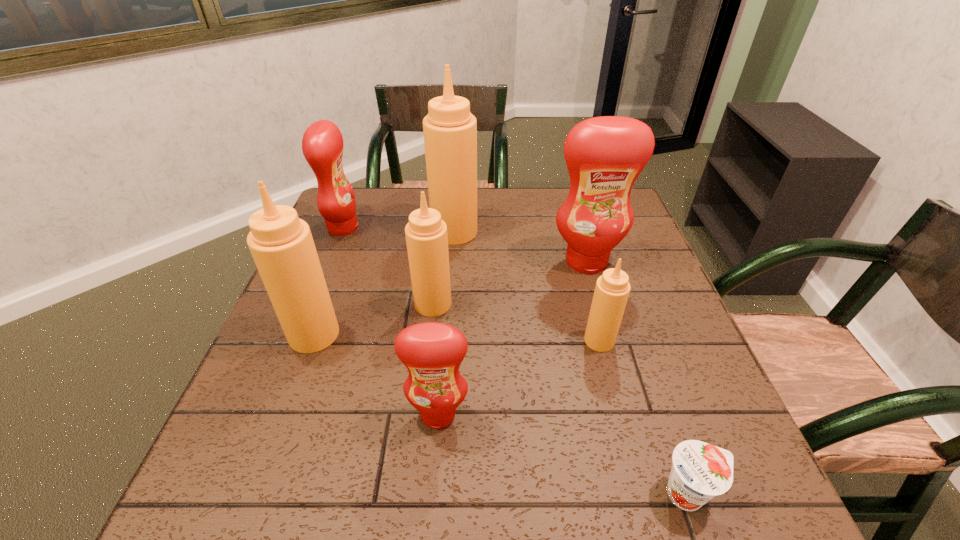
Find the location of a particular element. vacant space located 0.240m on the back of the nearest object is located at coordinates (640, 355).

Find the location of a particular element. object at the near edge is located at coordinates (700, 471).

Where is `condiment located in the right edge section of the desktop`? condiment located in the right edge section of the desktop is located at coordinates (604, 155).

Locate an element on the screen. The height and width of the screenshot is (540, 960). yogurt that is at the right edge is located at coordinates (700, 471).

Where is `object present at the far left corner`? The height and width of the screenshot is (540, 960). object present at the far left corner is located at coordinates click(x=322, y=144).

This screenshot has height=540, width=960. What are the coordinates of `object at the near right corner` in the screenshot? It's located at (700, 471).

Where is `free space at the far edge`? free space at the far edge is located at coordinates (512, 206).

Find the location of a particular element. The height and width of the screenshot is (540, 960). free space at the near edge of the desktop is located at coordinates (463, 508).

Find the location of a particular element. free space at the right edge of the desktop is located at coordinates (635, 258).

I want to click on vacant space at the far left corner, so click(386, 187).